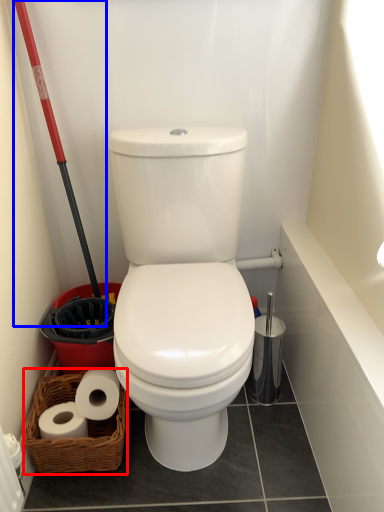
Question: Which of the following is the farthest to the observer, basket (highlighted by a red box) or shovel (highlighted by a blue box)?

Choices:
 (A) basket
 (B) shovel

Answer: (A)